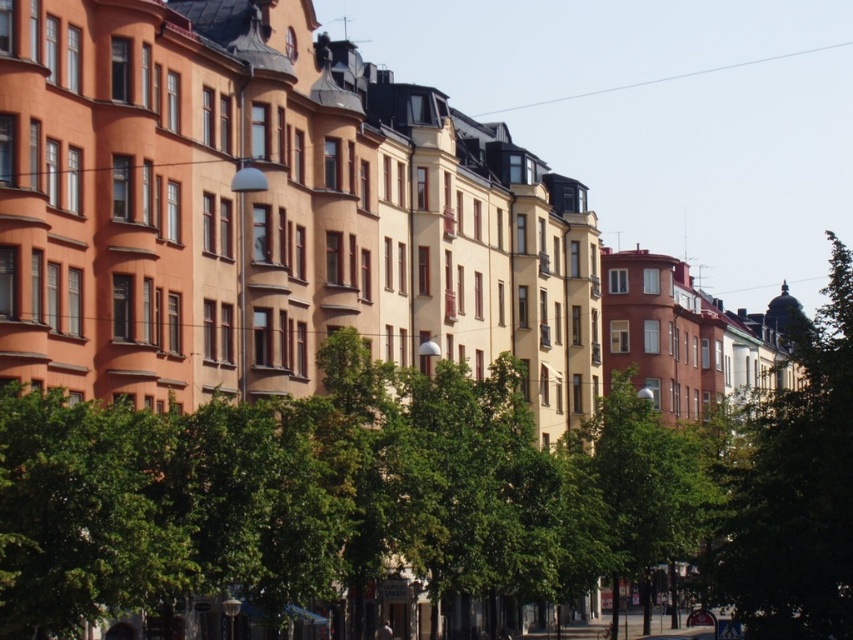
You are a bird looking for a place to perch. You see a green leafy tree at center and a transparent wire at upper center. Which one is taller?

The transparent wire at upper center is taller than the green leafy tree at center.

You are a city planner assessing the street. You notice the green leafy tree at center and the green leafy tree at right. Which tree would you recommend for shade in a new park if you want a larger tree?

The green leafy tree at right is larger than the green leafy tree at center, so it would provide more shade and be better suited for the new park.